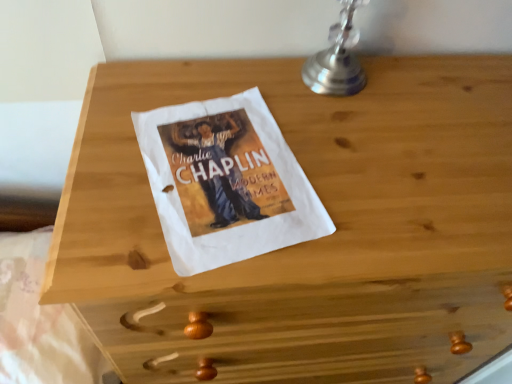
Find the location of a particular element. This screenshot has width=512, height=384. vacant area that is situated to the right of silver metallic table lamp at upper right is located at coordinates (421, 90).